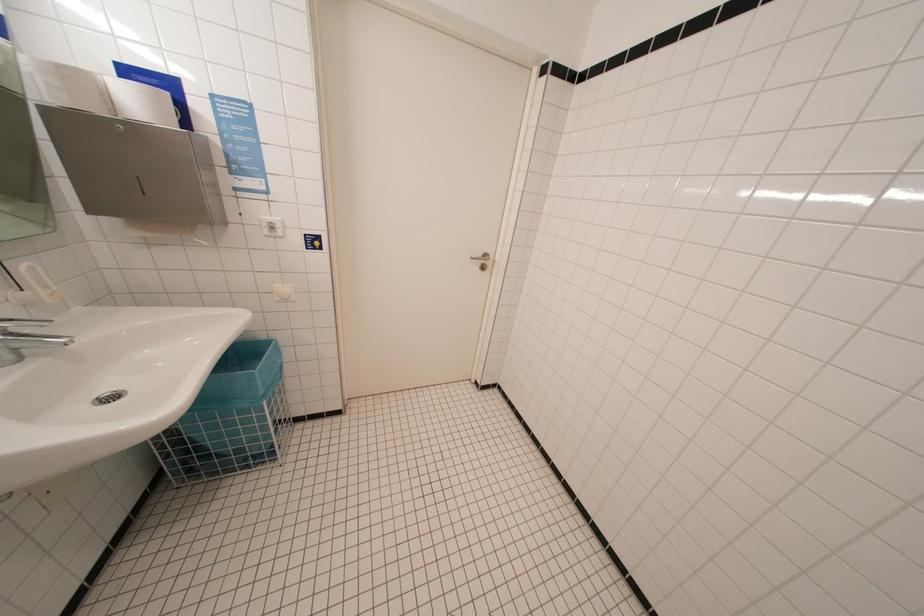
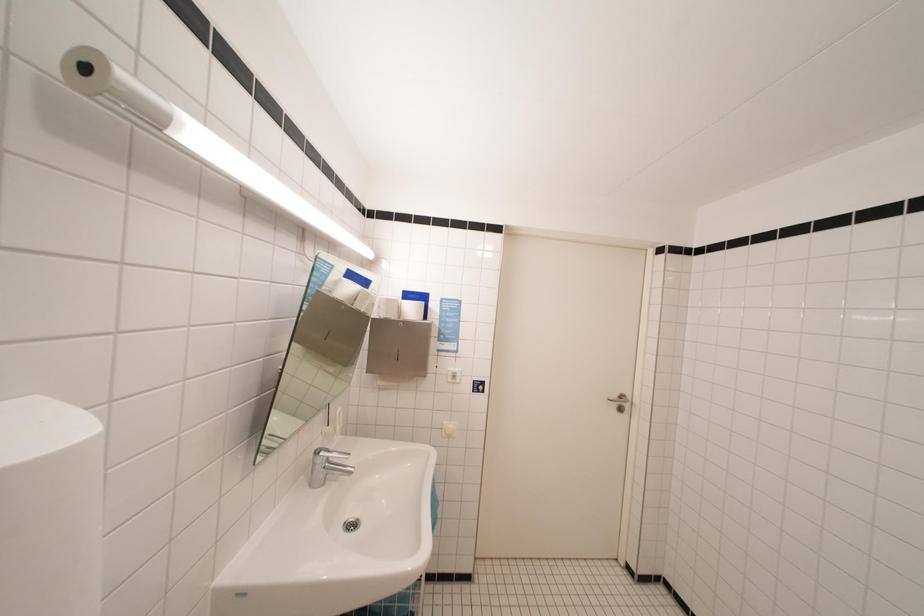
How did the camera likely rotate?

The camera rotated toward left-up.